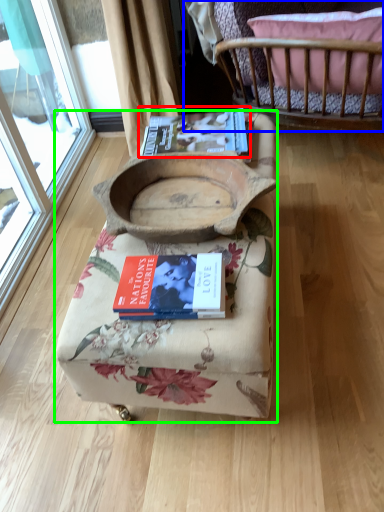
Question: Which object is the closest to the paperback book (highlighted by a red box)? Choose among these: furniture (highlighted by a blue box) or furniture (highlighted by a green box).

Choices:
 (A) furniture
 (B) furniture

Answer: (B)